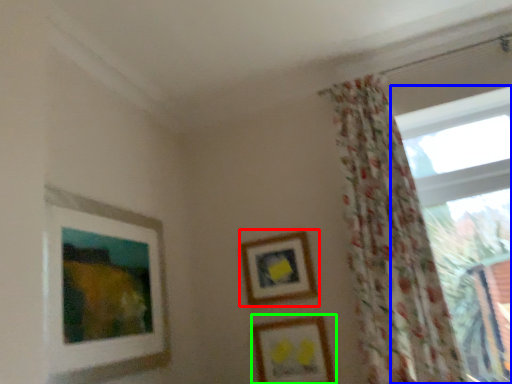
Question: Based on their relative distances, which object is farther from picture frame (highlighted by a red box)? Choose from window (highlighted by a blue box) and picture frame (highlighted by a green box).

Choices:
 (A) window
 (B) picture frame

Answer: (A)